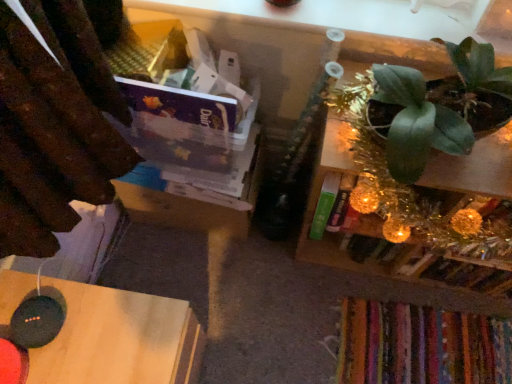
You are a GUI agent. You are given a task and a screenshot of the screen. Output one action in this format:
    pyautogui.click(x=<x>, y=<y>)
    Task: Click on the empty space that is ontop of black wood table at lower left (from a real-world perspective)
    The height and width of the screenshot is (384, 512).
    Given the screenshot: What is the action you would take?
    pyautogui.click(x=80, y=334)